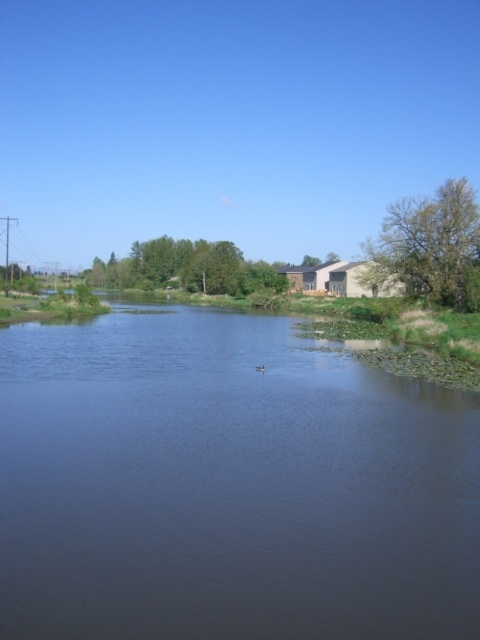
Question: Is dark blue water at center positioned behind brown fuzzy duck at center?

Choices:
 (A) yes
 (B) no

Answer: (B)

Question: Among these objects, which one is nearest to the camera?

Choices:
 (A) brown fuzzy duck at center
 (B) dark blue water at center

Answer: (B)

Question: Does dark blue water at center appear over brown fuzzy duck at center?

Choices:
 (A) yes
 (B) no

Answer: (B)

Question: In this image, where is dark blue water at center located relative to brown fuzzy duck at center?

Choices:
 (A) below
 (B) above

Answer: (A)

Question: Among these points, which one is nearest to the camera?

Choices:
 (A) click(x=374, y=444)
 (B) click(x=260, y=369)

Answer: (A)